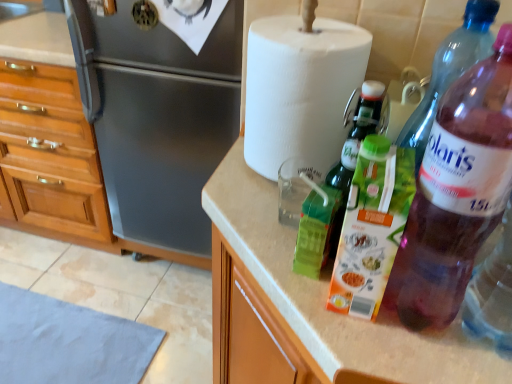
The image size is (512, 384). In order to click on vacant space that is to the left of translucent plastic bottle at right, the 1th bottle in the front-to-back sequence in this screenshot , I will do `click(305, 289)`.